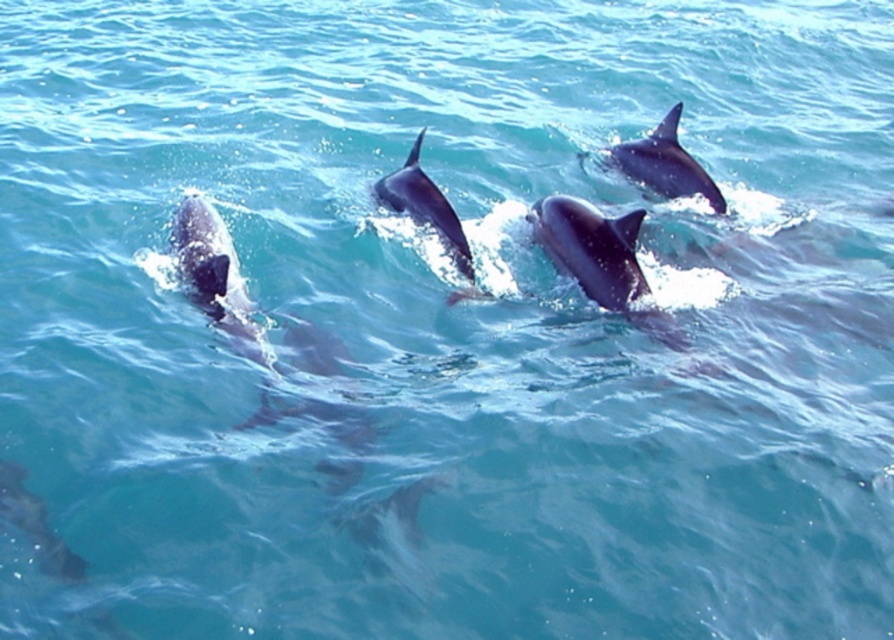
Between smooth gray dolphin at left and glossy blue dolphin at upper right, which one is positioned higher?

Positioned higher is glossy blue dolphin at upper right.

Is point (201, 307) closer to viewer compared to point (713, 200)?

Yes, it is in front of point (713, 200).

Between point (254, 360) and point (639, 148), which one is positioned in front?

Point (254, 360) is more forward.

Locate an element on the screen. smooth gray dolphin at left is located at coordinates (214, 275).

Between smooth gray dolphin at center and smooth gray dolphin at lower left, which one is positioned higher?

Positioned higher is smooth gray dolphin at center.

Does smooth gray dolphin at center have a greater height compared to smooth gray dolphin at lower left?

Yes, smooth gray dolphin at center is taller than smooth gray dolphin at lower left.

Does point (626, 308) come in front of point (41, 513)?

No.

Identify the location of smooth gray dolphin at center. (600, 259).

Does point (562, 220) come closer to viewer compared to point (676, 164)?

Yes, it is in front of point (676, 164).

Image resolution: width=894 pixels, height=640 pixels. What are the coordinates of `smooth gray dolphin at center` in the screenshot? It's located at (600, 259).